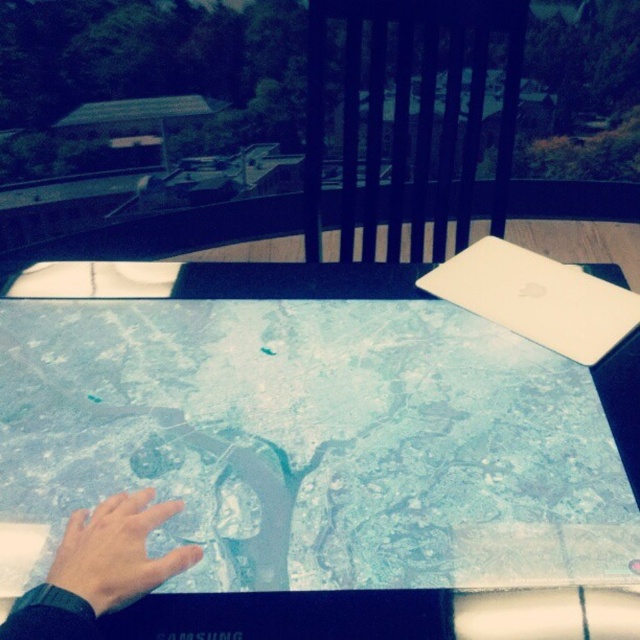
Question: Which point appears closest to the camera in this image?

Choices:
 (A) (452, 282)
 (B) (152, 561)
 (C) (420, 618)
 (D) (262, 358)

Answer: (B)

Question: Does white matte laptop at upper right appear over matte skin hand at lower left?

Choices:
 (A) yes
 (B) no

Answer: (A)

Question: Which point is farther to the camera?

Choices:
 (A) matte skin hand at lower left
 (B) transparent glass map at center

Answer: (B)

Question: Among these objects, which one is nearest to the camera?

Choices:
 (A) smooth skin hand at lower left
 (B) matte skin hand at lower left
 (C) white matte laptop at upper right
 (D) transparent glass map at center

Answer: (A)

Question: In this image, where is smooth skin hand at lower left located relative to matte skin hand at lower left?

Choices:
 (A) left
 (B) right

Answer: (B)

Question: Is the position of transparent glass map at center less distant than that of white matte laptop at upper right?

Choices:
 (A) no
 (B) yes

Answer: (B)